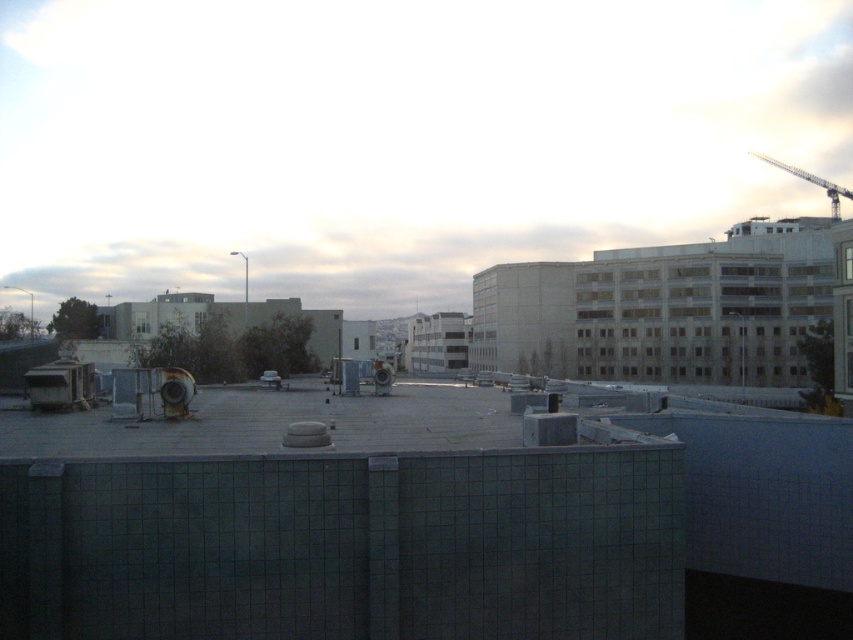
You are a delivery drone that needs to land on the rooftop. You see the gray concrete wall at center and the metallic gray crane at upper right. Which object is nearer to your current position as you approach the rooftop?

The gray concrete wall at center is closer to the viewer than the metallic gray crane at upper right, so the gray concrete wall at center is nearer to your current position as you approach the rooftop.

You are standing on the rooftop and want to walk from the point at coordinates point (367, 516) to the point at coordinates point (782, 168). Which direction should you move relative to the other point?

You should move towards the point at coordinates point (782, 168), as point (367, 516) is in front of it, meaning the destination is behind the starting point.